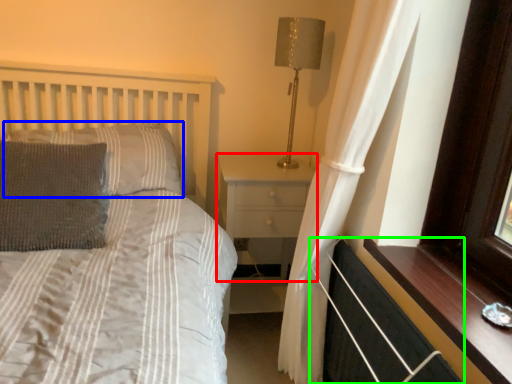
Question: Which object is positioned closest to nightstand (highlighted by a red box)? Select from pillow (highlighted by a blue box) and balustrade (highlighted by a green box).

Choices:
 (A) pillow
 (B) balustrade

Answer: (A)